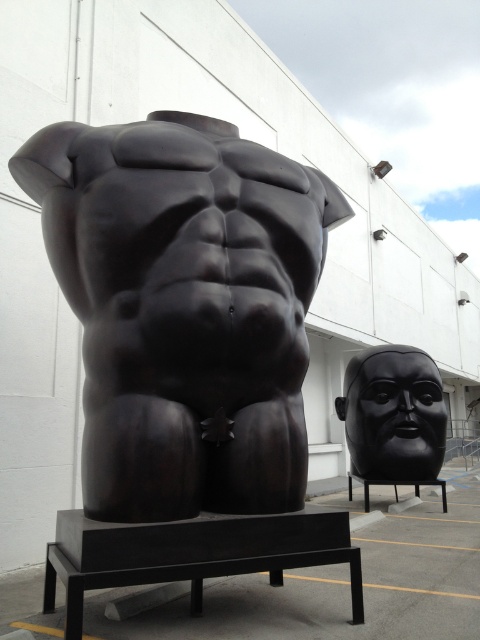
You are a visitor standing at the entrance of the white building and want to sit on the black metal bench at lower right to admire the black glossy mask at right. Is the distance between them sufficient for you to comfortably walk from the entrance to the bench and then to the mask?

The black glossy mask at right is 37.62 inches away from the black metal bench at lower right. Since 37.62 inches is approximately 3.13 feet, this distance is too short for comfortable walking between the black metal bench at lower right and the black glossy mask at right. You may need to adjust your path or position to move comfortably between them.

From the picture: You are an art student who wants to sketch both the black glossy mask at right and the black metal bench at lower right. Which object should you draw first if you want to capture the one that is higher up in the scene?

The black glossy mask at right is located above the black metal bench at lower right, so you should draw the black glossy mask at right first to capture its higher position.